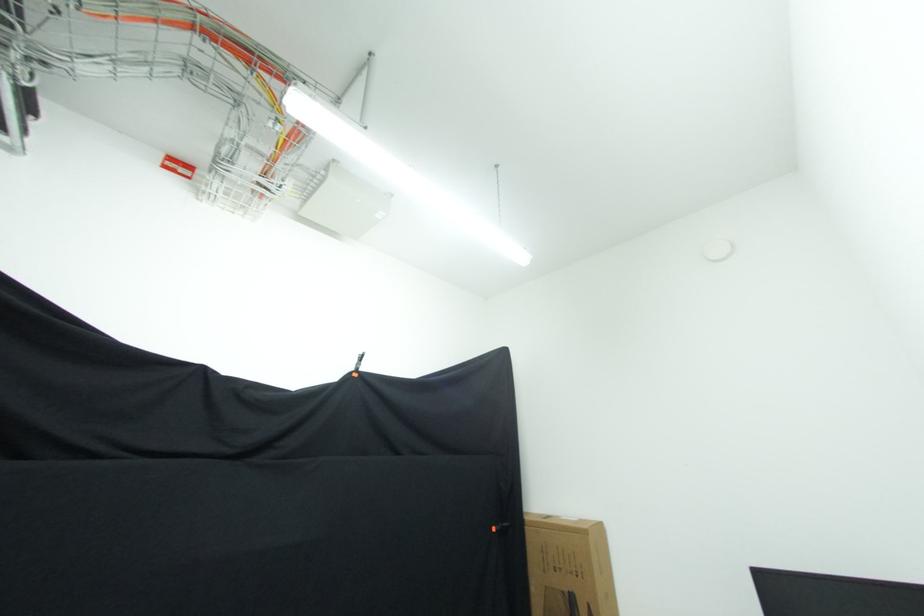
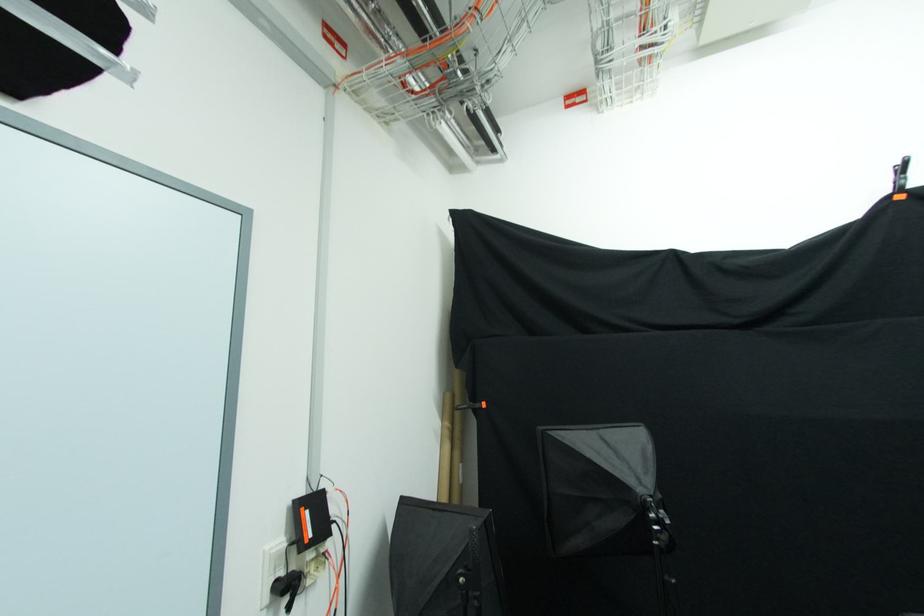
In the second image, find the point that corresponds to (x=362, y=367) in the first image.

(904, 180)